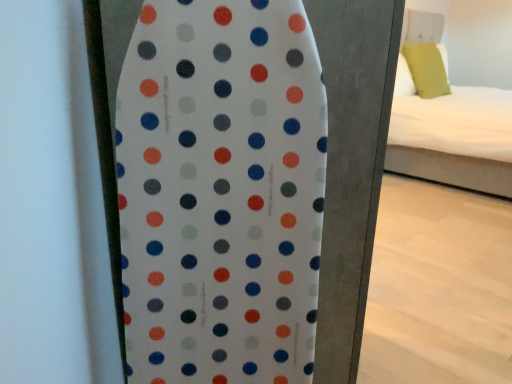
Image resolution: width=512 pixels, height=384 pixels. What do you see at coordinates (221, 192) in the screenshot?
I see `white dotted surfboard at center` at bounding box center [221, 192].

Describe the element at coordinates (426, 69) in the screenshot. The height and width of the screenshot is (384, 512). I see `green fabric pillow at upper right` at that location.

Identify the location of white fabric bed at right. This screenshot has width=512, height=384. (452, 136).

The width and height of the screenshot is (512, 384). In the image, there is a green fabric pillow at upper right. In order to click on bed below it (from the image's perspective) in this screenshot , I will do `click(452, 136)`.

Considering the sizes of objects green fabric pillow at upper right and white fabric bed at right in the image provided, who is smaller, green fabric pillow at upper right or white fabric bed at right?

green fabric pillow at upper right.

In the scene shown: How distant is green fabric pillow at upper right from white fabric bed at right?

green fabric pillow at upper right and white fabric bed at right are 15.58 inches apart.

Is green fabric pillow at upper right facing away from white fabric bed at right?

Yes.

From the image's perspective, would you say green fabric pillow at upper right is positioned over white dotted surfboard at center?

Correct, green fabric pillow at upper right appears higher than white dotted surfboard at center in the image.

Which of these two, green fabric pillow at upper right or white dotted surfboard at center, stands shorter?

Standing shorter between the two is green fabric pillow at upper right.

Image resolution: width=512 pixels, height=384 pixels. Identify the location of pillow above the white dotted surfboard at center (from a real-world perspective). (426, 69).

How many degrees apart are the facing directions of white dotted surfboard at center and green fabric pillow at upper right?

The facing directions of white dotted surfboard at center and green fabric pillow at upper right are 43.3 degrees apart.

Is white dotted surfboard at center bigger than green fabric pillow at upper right?

Yes.

Looking at this image, from a real-world perspective, is white dotted surfboard at center beneath green fabric pillow at upper right?

Yes, from a real-world perspective, white dotted surfboard at center is below green fabric pillow at upper right.

Does white dotted surfboard at center have a greater width compared to green fabric pillow at upper right?

Indeed, white dotted surfboard at center has a greater width compared to green fabric pillow at upper right.

Considering the sizes of objects white dotted surfboard at center and white fabric bed at right in the image provided, who is thinner, white dotted surfboard at center or white fabric bed at right?

With smaller width is white dotted surfboard at center.

Based on the photo, can you confirm if white dotted surfboard at center is positioned to the left of white fabric bed at right?

Yes.

How far apart are white dotted surfboard at center and white fabric bed at right?

white dotted surfboard at center and white fabric bed at right are 2.64 meters apart from each other.

Is white dotted surfboard at center directly adjacent to white fabric bed at right?

There is a gap between white dotted surfboard at center and white fabric bed at right.

In terms of size, does white fabric bed at right appear bigger or smaller than green fabric pillow at upper right?

Clearly, white fabric bed at right is larger in size than green fabric pillow at upper right.

Is point (400, 88) positioned in front of point (423, 68)?

Yes, it is.

Can we say white fabric bed at right lies outside green fabric pillow at upper right?

Yes.

From a real-world perspective, which object rests below the other?

In real-world perspective, white fabric bed at right is lower.

Is white fabric bed at right directly adjacent to white dotted surfboard at center?

No, white fabric bed at right is not next to white dotted surfboard at center.

At what (x,y) coordinates should I click in order to perform the action: click on surfboard located on the left of white fabric bed at right. Please return your answer as a coordinate pair (x, y). The width and height of the screenshot is (512, 384). Looking at the image, I should click on (221, 192).

Is point (484, 136) farther from viewer compared to point (247, 312)?

Yes, point (484, 136) is behind point (247, 312).

Locate an element on the screen. This screenshot has height=384, width=512. pillow located behind the white fabric bed at right is located at coordinates (426, 69).

You are a GUI agent. You are given a task and a screenshot of the screen. Output one action in this format:
    pyautogui.click(x=<x>, y=<y>)
    Task: Click on the surfboard that appears below the green fabric pillow at upper right (from the image's perspective)
    
    Given the screenshot: What is the action you would take?
    pyautogui.click(x=221, y=192)

Considering their positions, is green fabric pillow at upper right positioned further to white fabric bed at right than white dotted surfboard at center?

white dotted surfboard at center.

Looking at this image, from the image, which object appears to be nearer to green fabric pillow at upper right, white fabric bed at right or white dotted surfboard at center?

Based on the image, white fabric bed at right appears to be nearer to green fabric pillow at upper right.

Based on their spatial positions, is white dotted surfboard at center or green fabric pillow at upper right further from white fabric bed at right?

Based on the image, white dotted surfboard at center appears to be further to white fabric bed at right.

Based on their spatial positions, is green fabric pillow at upper right or white fabric bed at right further from white dotted surfboard at center?

Based on the image, green fabric pillow at upper right appears to be further to white dotted surfboard at center.

Which object lies further to the anchor point white dotted surfboard at center, white fabric bed at right or green fabric pillow at upper right?

green fabric pillow at upper right is positioned further to the anchor white dotted surfboard at center.

Consider the image. From the image, which object appears to be nearer to green fabric pillow at upper right, white dotted surfboard at center or white fabric bed at right?

white fabric bed at right.

Where is `bed between white dotted surfboard at center and green fabric pillow at upper right from front to back`? The width and height of the screenshot is (512, 384). bed between white dotted surfboard at center and green fabric pillow at upper right from front to back is located at coordinates (452, 136).